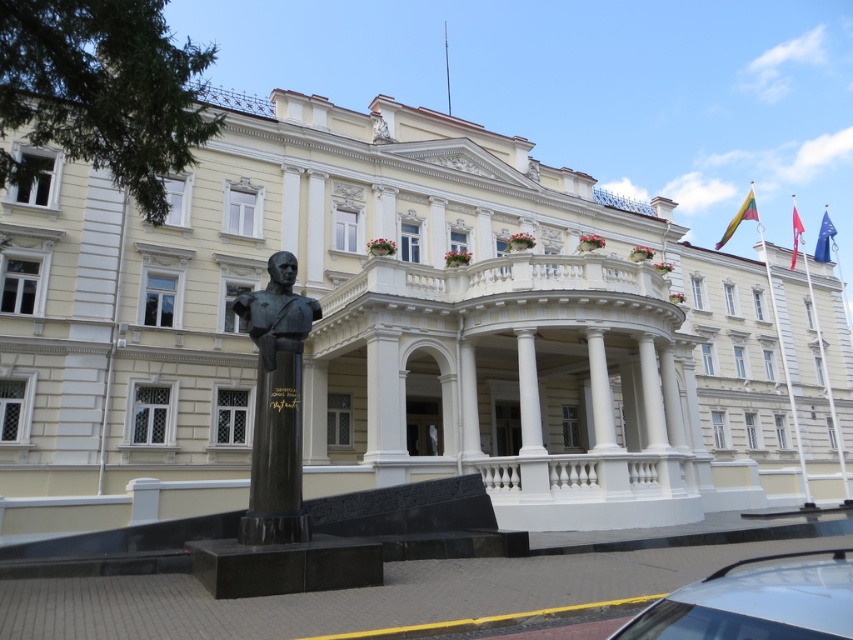
Question: Which point is farther to the camera?

Choices:
 (A) (740, 216)
 (B) (770, 627)
 (C) (293, 304)
 (D) (296, 360)

Answer: (A)

Question: Which is nearer to the blue fabric flag at upper right?

Choices:
 (A) black polished stone bust at center
 (B) white glossy car at lower right
 (C) black polished bust at center

Answer: (A)

Question: Does black polished stone bust at center come in front of polished metal flagpole at upper right?

Choices:
 (A) yes
 (B) no

Answer: (A)

Question: Does black polished stone bust at center have a lesser width compared to black polished bust at center?

Choices:
 (A) yes
 (B) no

Answer: (A)

Question: Which of the following is the closest to the observer?

Choices:
 (A) (x=825, y=236)
 (B) (x=253, y=451)
 (C) (x=804, y=493)
 (D) (x=793, y=212)

Answer: (B)

Question: Can you confirm if yellow fabric flag at upper right is positioned below red fabric flag at upper right?

Choices:
 (A) yes
 (B) no

Answer: (B)